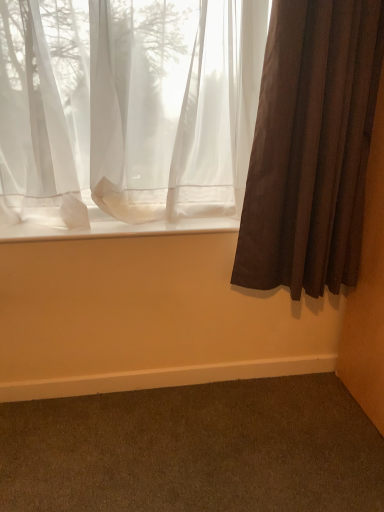
Question: Does white sheer fabric at lower center have a greater height compared to sheer white curtain at upper left, the 1th curtain in the left-to-right sequence?

Choices:
 (A) yes
 (B) no

Answer: (B)

Question: From a real-world perspective, is white sheer fabric at lower center below sheer white curtain at upper left, positioned as the 2th curtain in right-to-left order?

Choices:
 (A) yes
 (B) no

Answer: (A)

Question: Is white sheer fabric at lower center touching sheer white curtain at upper left, positioned as the 2th curtain in right-to-left order?

Choices:
 (A) yes
 (B) no

Answer: (B)

Question: Does white sheer fabric at lower center have a lesser width compared to sheer white curtain at upper left, positioned as the 2th curtain in right-to-left order?

Choices:
 (A) no
 (B) yes

Answer: (A)

Question: Is white sheer fabric at lower center closer to camera compared to sheer white curtain at upper left, positioned as the 2th curtain in right-to-left order?

Choices:
 (A) no
 (B) yes

Answer: (A)

Question: Considering their positions, is dark brown carpet at lower right located in front of or behind brown textured curtain at right, the 2th curtain positioned from the left?

Choices:
 (A) front
 (B) behind

Answer: (A)

Question: In terms of width, does dark brown carpet at lower right look wider or thinner when compared to brown textured curtain at right, the 2th curtain positioned from the left?

Choices:
 (A) thin
 (B) wide

Answer: (B)

Question: From their relative heights in the image, would you say dark brown carpet at lower right is taller or shorter than brown textured curtain at right, the 2th curtain positioned from the left?

Choices:
 (A) tall
 (B) short

Answer: (B)

Question: From a real-world perspective, is dark brown carpet at lower right positioned above or below brown textured curtain at right, which is the first curtain from right to left?

Choices:
 (A) below
 (B) above

Answer: (A)

Question: From the image's perspective, is sheer white curtain at upper left, positioned as the 2th curtain in right-to-left order, positioned above or below dark brown carpet at lower right?

Choices:
 (A) above
 (B) below

Answer: (A)

Question: Relative to dark brown carpet at lower right, is sheer white curtain at upper left, positioned as the 2th curtain in right-to-left order, in front or behind?

Choices:
 (A) behind
 (B) front

Answer: (A)

Question: Is point (29, 42) positioned closer to the camera than point (324, 417)?

Choices:
 (A) closer
 (B) farther

Answer: (A)

Question: Is sheer white curtain at upper left, positioned as the 2th curtain in right-to-left order, bigger or smaller than dark brown carpet at lower right?

Choices:
 (A) big
 (B) small

Answer: (A)

Question: Based on their sizes in the image, would you say sheer white curtain at upper left, the 1th curtain in the left-to-right sequence, is bigger or smaller than white sheer fabric at lower center?

Choices:
 (A) small
 (B) big

Answer: (B)

Question: From a real-world perspective, is sheer white curtain at upper left, the 1th curtain in the left-to-right sequence, physically located above or below white sheer fabric at lower center?

Choices:
 (A) below
 (B) above

Answer: (B)